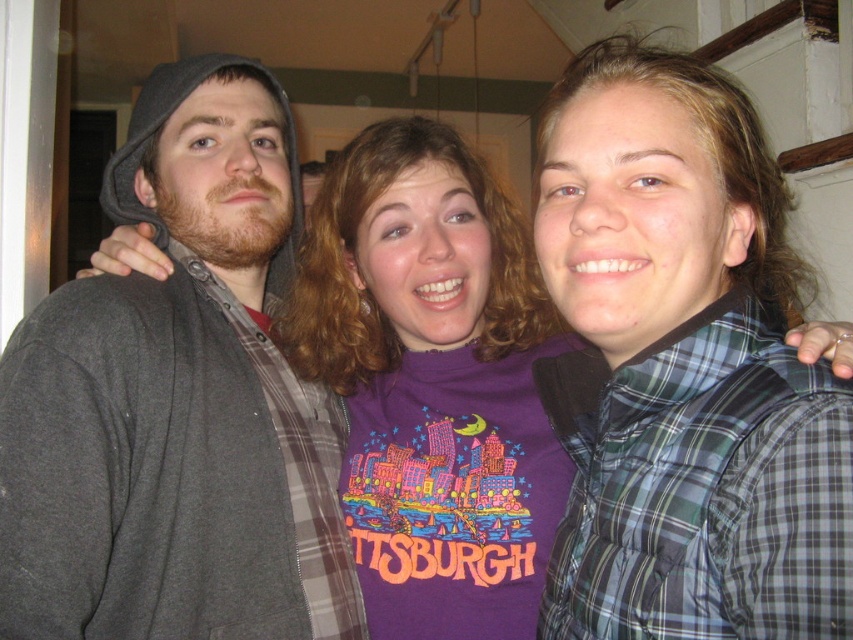
Question: Does green plaid vest at right have a lesser width compared to dark gray hoodie at left?

Choices:
 (A) no
 (B) yes

Answer: (B)

Question: From the image, what is the correct spatial relationship of green plaid vest at right in relation to dark gray hoodie at left?

Choices:
 (A) below
 (B) above

Answer: (B)

Question: Which point is closer to the camera taking this photo?

Choices:
 (A) (225, 426)
 (B) (662, 344)
 (C) (572, 216)

Answer: (B)

Question: Based on their relative distances, which object is farther from the purple cotton t-shirt at center?

Choices:
 (A) dark gray hoodie at left
 (B) green plaid vest at right

Answer: (A)

Question: Which point appears closest to the camera in this image?

Choices:
 (A) (115, 528)
 (B) (532, 307)
 (C) (611, 326)

Answer: (C)

Question: From the image, what is the correct spatial relationship of green plaid vest at right in relation to dark gray hoodie at left?

Choices:
 (A) below
 (B) above

Answer: (B)